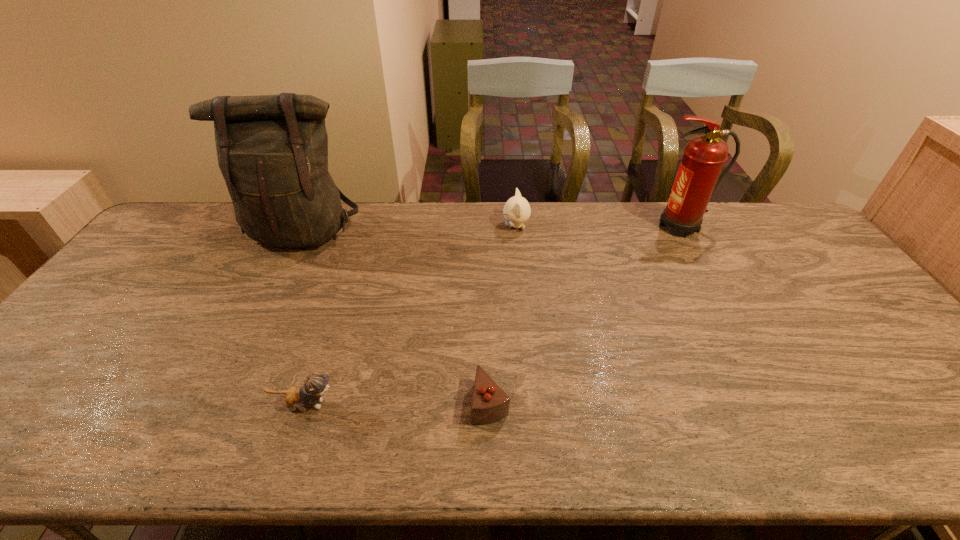
Find the location of a particular element. This screenshot has height=540, width=960. the tallest object is located at coordinates (272, 150).

Where is `fire extinguisher`? The height and width of the screenshot is (540, 960). fire extinguisher is located at coordinates (704, 156).

The height and width of the screenshot is (540, 960). Identify the location of the second tallest object. (704, 156).

The width and height of the screenshot is (960, 540). What are the coordinates of `the right kitten` in the screenshot? It's located at (517, 210).

Image resolution: width=960 pixels, height=540 pixels. What are the coordinates of `the farther kitten` in the screenshot? It's located at (517, 210).

Where is `the left kitten`? This screenshot has width=960, height=540. the left kitten is located at coordinates (315, 385).

The height and width of the screenshot is (540, 960). I want to click on the nearer kitten, so click(x=315, y=385).

Find the location of a particular element. Image resolution: width=960 pixels, height=540 pixels. chocolate cake is located at coordinates (490, 403).

Find the location of a particular element. Image resolution: width=960 pixels, height=540 pixels. the third object from left to right is located at coordinates (490, 403).

Where is `free space located on the open flap of the tallest object`? The height and width of the screenshot is (540, 960). free space located on the open flap of the tallest object is located at coordinates (239, 361).